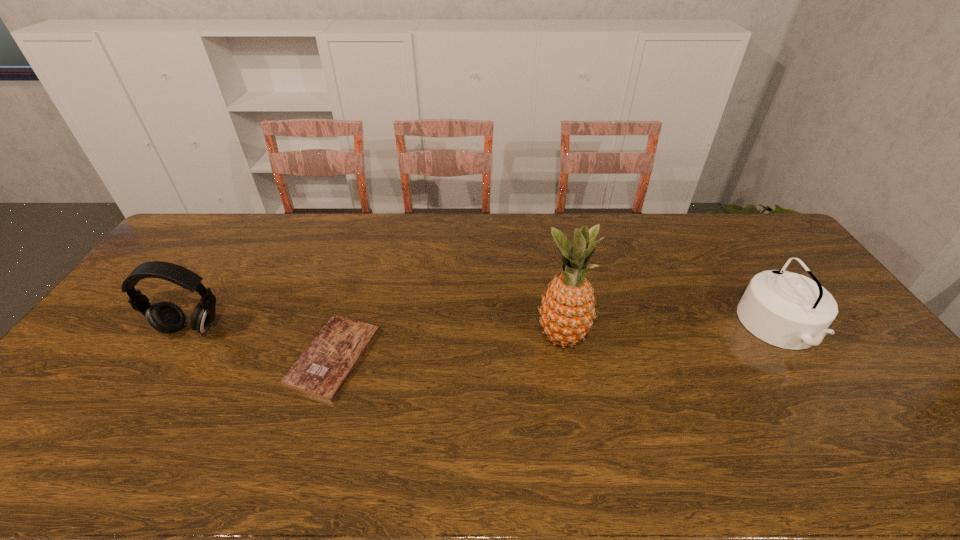
Where is `vacant space located 0.230m on the spout of the rightmost object`? The height and width of the screenshot is (540, 960). vacant space located 0.230m on the spout of the rightmost object is located at coordinates (665, 328).

The width and height of the screenshot is (960, 540). Find the location of `free space located 0.320m on the spout of the rightmost object`. free space located 0.320m on the spout of the rightmost object is located at coordinates (635, 328).

You are a GUI agent. You are given a task and a screenshot of the screen. Output one action in this format:
    pyautogui.click(x=<x>, y=<y>)
    Task: Click on the vacant region located on the spout of the rightmost object
    Image resolution: width=960 pixels, height=540 pixels.
    Given the screenshot: What is the action you would take?
    pyautogui.click(x=723, y=328)

Locate an element on the screen. This screenshot has height=540, width=960. vacant region located on the back of the third object from right to left is located at coordinates click(x=357, y=281).

This screenshot has width=960, height=540. In order to click on object that is positioned at the left edge in this screenshot , I will do `click(166, 317)`.

Image resolution: width=960 pixels, height=540 pixels. Find the location of `object located at the right edge`. object located at the right edge is located at coordinates (788, 310).

Find the location of a particular element. Image resolution: width=960 pixels, height=540 pixels. vacant space at the far edge of the desktop is located at coordinates (337, 217).

You are a GUI agent. You are given a task and a screenshot of the screen. Output one action in this format:
    pyautogui.click(x=<x>, y=<y>)
    Task: Click on the vacant space at the near edge
    The height and width of the screenshot is (540, 960).
    Given the screenshot: What is the action you would take?
    pyautogui.click(x=598, y=444)

In the image, there is a desktop. Identify the location of blank space at the left edge. The width and height of the screenshot is (960, 540). (183, 255).

Find the location of `free space at the near right corner of the desktop`. free space at the near right corner of the desktop is located at coordinates (914, 476).